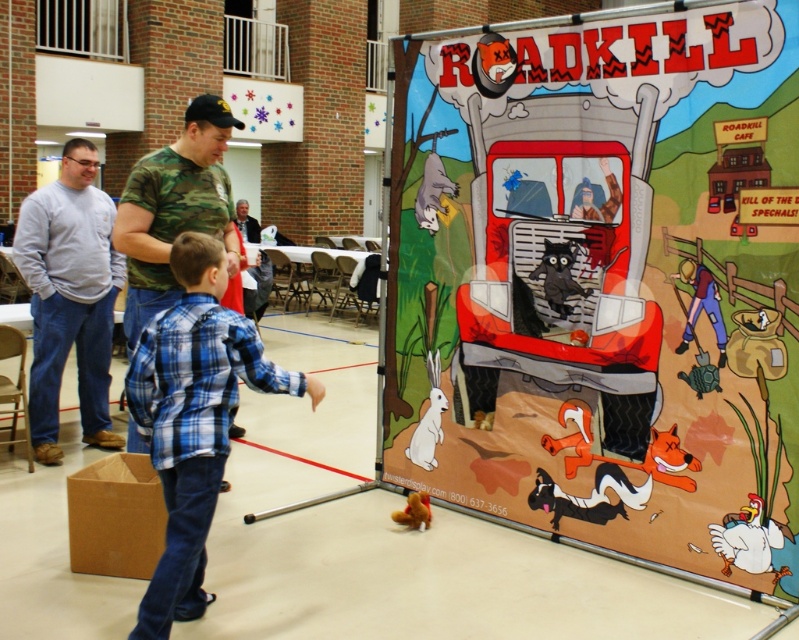
Question: Which point is farther to the camera?

Choices:
 (A) brown plush bear at lower center
 (B) camo fabric shirt at center
 (C) cartoonish paper truck at center

Answer: (A)

Question: Is cartoonish paper truck at center to the right of camo fabric shirt at center from the viewer's perspective?

Choices:
 (A) yes
 (B) no

Answer: (A)

Question: Estimate the real-world distances between objects in this image. Which object is closer to the gray cotton sweatshirt at left?

Choices:
 (A) brown plush bear at lower center
 (B) white matte chicken at lower right
 (C) blue plaid shirt at center

Answer: (C)

Question: Can you confirm if gray cotton sweatshirt at left is thinner than brown plush bear at lower center?

Choices:
 (A) yes
 (B) no

Answer: (B)

Question: Can you confirm if cartoonish paper truck at center is positioned above white matte chicken at lower right?

Choices:
 (A) yes
 (B) no

Answer: (A)

Question: Which of the following is the closest to the observer?

Choices:
 (A) blue plaid shirt at center
 (B) brown plush bear at lower center
 (C) cartoonish paper truck at center

Answer: (A)